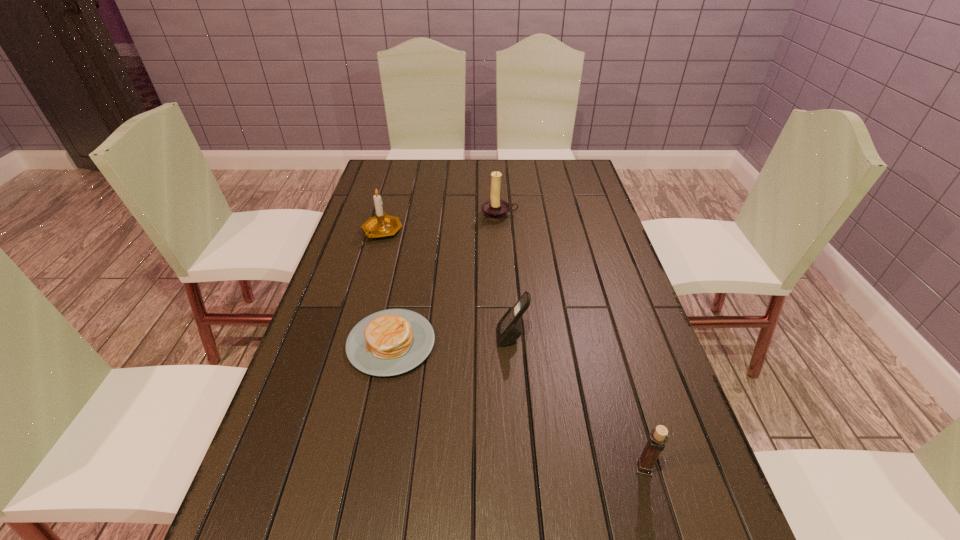
Identify the location of free point located on the front-facing side of the cellular telephone. (429, 337).

The height and width of the screenshot is (540, 960). I want to click on free location located on the left of the rightmost candle holder, so click(444, 468).

At what (x,y) coordinates should I click in order to perform the action: click on free region located on the right of the pancake. Please return your answer as a coordinate pair (x, y). Looking at the image, I should click on (536, 343).

Image resolution: width=960 pixels, height=540 pixels. Identify the location of candle holder located at the left edge. (381, 225).

Locate an element on the screen. pancake present at the left edge is located at coordinates (390, 342).

At what (x,y) coordinates should I click in order to perform the action: click on object that is at the right edge. Please return your answer as a coordinate pair (x, y). Looking at the image, I should click on (658, 437).

Find the location of a particular element. The image size is (960, 540). blank area at the far edge is located at coordinates (487, 161).

The width and height of the screenshot is (960, 540). What are the coordinates of `free space at the left edge of the desktop` in the screenshot? It's located at (341, 316).

Locate an element on the screen. This screenshot has width=960, height=540. vacant region at the right edge of the desktop is located at coordinates (612, 304).

Image resolution: width=960 pixels, height=540 pixels. I want to click on vacant space at the far left corner of the desktop, so click(384, 178).